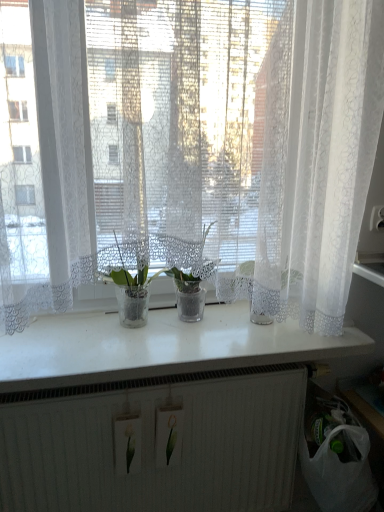
Question: Is white glossy counter top at center in front of clear glass vase at center, the 1th houseplant when ordered from left to right?

Choices:
 (A) yes
 (B) no

Answer: (A)

Question: Is white glossy counter top at center smaller than clear glass vase at center, acting as the second houseplant starting from the right?

Choices:
 (A) no
 (B) yes

Answer: (A)

Question: Would you say white glossy counter top at center contains clear glass vase at center, the 1th houseplant when ordered from left to right?

Choices:
 (A) no
 (B) yes

Answer: (A)

Question: Could you tell me if white glossy counter top at center is facing clear glass vase at center, acting as the second houseplant starting from the right?

Choices:
 (A) no
 (B) yes

Answer: (A)

Question: Is white glossy counter top at center positioned far away from clear glass vase at center, acting as the second houseplant starting from the right?

Choices:
 (A) yes
 (B) no

Answer: (B)

Question: Based on their sizes in the image, would you say white lace curtain at center is bigger or smaller than clear glass vase at center, the 1th houseplant when ordered from left to right?

Choices:
 (A) big
 (B) small

Answer: (A)

Question: Is white lace curtain at center wider or thinner than clear glass vase at center, the 1th houseplant when ordered from left to right?

Choices:
 (A) thin
 (B) wide

Answer: (B)

Question: Considering their positions, is white lace curtain at center located in front of or behind clear glass vase at center, the 1th houseplant when ordered from left to right?

Choices:
 (A) behind
 (B) front

Answer: (B)

Question: Is point (258, 117) closer or farther from the camera than point (142, 301)?

Choices:
 (A) farther
 (B) closer

Answer: (B)

Question: Which is correct: translucent glass pot at center, marked as the second houseplant in a left-to-right arrangement, is inside white lace curtain at center, or outside of it?

Choices:
 (A) inside
 (B) outside

Answer: (B)

Question: From the image's perspective, is translucent glass pot at center, marked as the second houseplant in a left-to-right arrangement, positioned above or below white lace curtain at center?

Choices:
 (A) above
 (B) below

Answer: (B)

Question: From a real-world perspective, is translucent glass pot at center, the first houseplant from the right, above or below white lace curtain at center?

Choices:
 (A) above
 (B) below

Answer: (B)

Question: Is translucent glass pot at center, marked as the second houseplant in a left-to-right arrangement, wider or thinner than white lace curtain at center?

Choices:
 (A) thin
 (B) wide

Answer: (A)

Question: Looking at their shapes, would you say clear glass vase at center, acting as the second houseplant starting from the right, is wider or thinner than white glossy counter top at center?

Choices:
 (A) wide
 (B) thin

Answer: (B)

Question: Is clear glass vase at center, the 1th houseplant when ordered from left to right, inside the boundaries of white glossy counter top at center, or outside?

Choices:
 (A) inside
 (B) outside

Answer: (B)